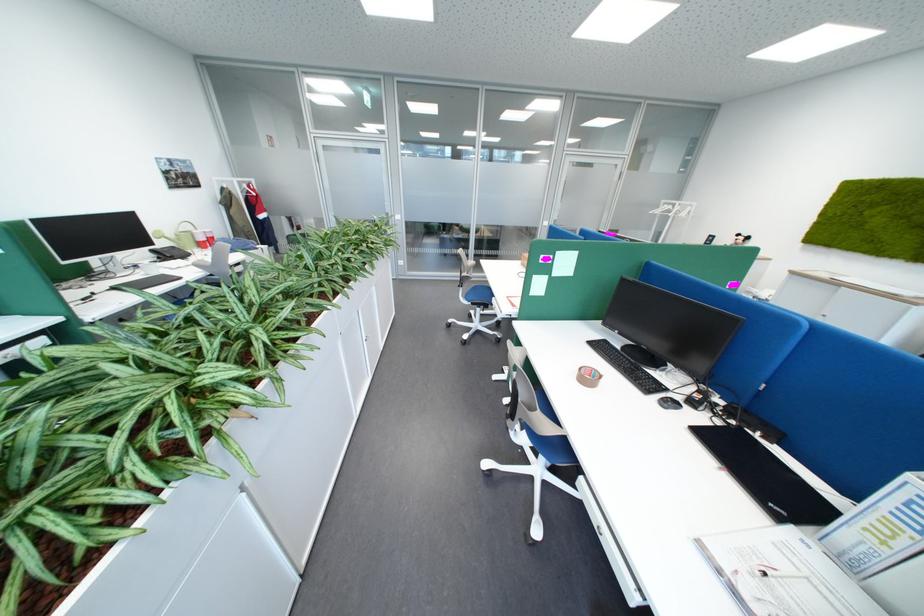
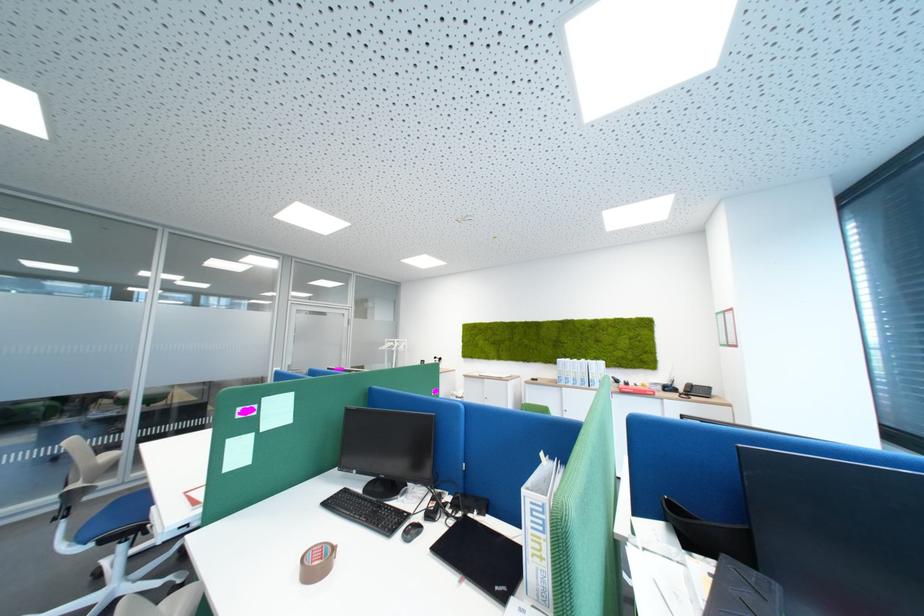
First-person continuous shooting, in which direction is the camera rotating?

The camera's rotation is toward right-up.